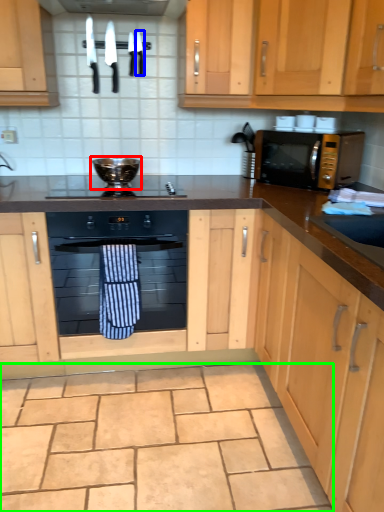
Question: Which object is positioned closest to appliance (highlighted by a red box)? Select from knife (highlighted by a blue box) and granite (highlighted by a green box).

Choices:
 (A) knife
 (B) granite

Answer: (A)